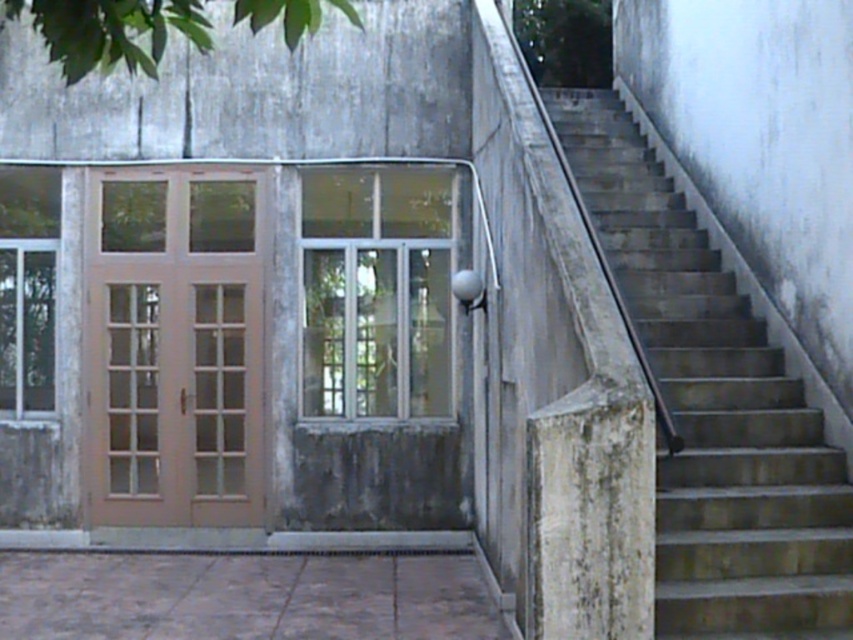
Consider the image. You are a delivery person carrying a heavy package and need to place it on the nearest surface. You see the concrete stairs at right and the light brown wood door at left. Which surface is narrower and thus harder to place the package?

The concrete stairs at right is thinner than the light brown wood door at left, so it is narrower and harder to place the package there.

You are a painter who needs to decide which tool to use. You have a ladder that can reach up to 2 meters. The concrete stairs at right and the light brown wood door at left are both in your work area. Which object requires the ladder to paint?

The light brown wood door at left requires the ladder because it is taller than the concrete stairs at right, which are shorter in height.

You are standing at the base of the staircase and want to reach the top of the building. Which point, point (x=660, y=625) or point (x=183, y=524), is closer to you as you start climbing the stairs?

Point (x=660, y=625) is closer to the viewer than point (x=183, y=524), so it is closer to you as you start climbing the stairs.